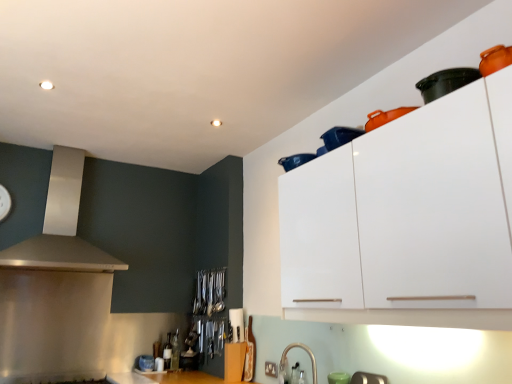
Question: From a real-world perspective, is satin silver vent at upper left positioned under metallic silver gas stove at lower left based on gravity?

Choices:
 (A) yes
 (B) no

Answer: (B)

Question: Considering the relative positions of satin silver vent at upper left and metallic silver gas stove at lower left in the image provided, is satin silver vent at upper left behind metallic silver gas stove at lower left?

Choices:
 (A) no
 (B) yes

Answer: (B)

Question: Can you confirm if satin silver vent at upper left is wider than metallic silver gas stove at lower left?

Choices:
 (A) yes
 (B) no

Answer: (B)

Question: Is satin silver vent at upper left to the right of metallic silver gas stove at lower left from the viewer's perspective?

Choices:
 (A) no
 (B) yes

Answer: (A)

Question: From a real-world perspective, is satin silver vent at upper left over metallic silver gas stove at lower left?

Choices:
 (A) yes
 (B) no

Answer: (A)

Question: In terms of width, does satin nickel faucet at lower center, placed as the second appliance when sorted from bottom to top, look wider or thinner when compared to blue plastic container at upper center, the first appliance when ordered from front to back?

Choices:
 (A) wide
 (B) thin

Answer: (B)

Question: Relative to blue plastic container at upper center, the first appliance viewed from the top, is satin nickel faucet at lower center, the second appliance when ordered from right to left, in front or behind?

Choices:
 (A) front
 (B) behind

Answer: (B)

Question: From the image's perspective, relative to blue plastic container at upper center, the 3th appliance in the back-to-front sequence, is satin nickel faucet at lower center, which is the second appliance from front to back, above or below?

Choices:
 (A) above
 (B) below

Answer: (B)

Question: From a real-world perspective, is satin nickel faucet at lower center, the second appliance positioned from the back, positioned above or below blue plastic container at upper center, the first appliance viewed from the top?

Choices:
 (A) below
 (B) above

Answer: (A)

Question: In terms of height, does blue plastic container at upper center, the first appliance viewed from the top, look taller or shorter compared to satin silver vent at upper left?

Choices:
 (A) tall
 (B) short

Answer: (B)

Question: Considering their positions, is blue plastic container at upper center, the 3th appliance in the back-to-front sequence, located in front of or behind satin silver vent at upper left?

Choices:
 (A) behind
 (B) front

Answer: (B)

Question: Is blue plastic container at upper center, the first appliance when ordered from front to back, inside the boundaries of satin silver vent at upper left, or outside?

Choices:
 (A) outside
 (B) inside

Answer: (A)

Question: In the image, is blue plastic container at upper center, the third appliance ordered from the bottom, on the left side or the right side of satin silver vent at upper left?

Choices:
 (A) left
 (B) right

Answer: (B)

Question: From the image's perspective, is metallic silver gas stove at lower left located above or below blue plastic container at upper center, the 3th appliance in the back-to-front sequence?

Choices:
 (A) below
 (B) above

Answer: (A)

Question: Considering their positions, is metallic silver gas stove at lower left located in front of or behind blue plastic container at upper center, the third appliance ordered from the bottom?

Choices:
 (A) behind
 (B) front

Answer: (A)